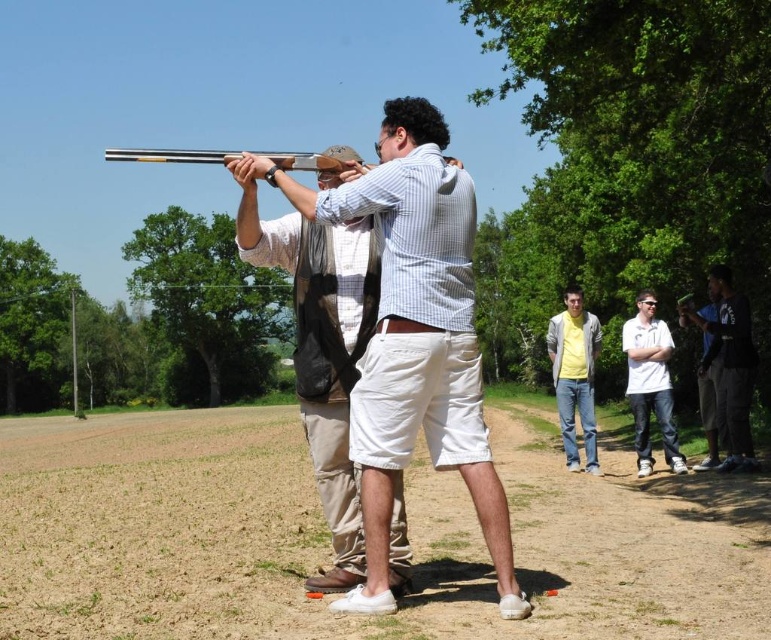
Question: Does matte black shotgun at center appear on the left side of yellow brushed cotton shirt at center?

Choices:
 (A) no
 (B) yes

Answer: (B)

Question: Does matte black shotgun at center appear over yellow brushed cotton shirt at center?

Choices:
 (A) no
 (B) yes

Answer: (B)

Question: Which object is the closest to the white matte shirt at center?

Choices:
 (A) matte black shotgun at center
 (B) yellow brushed cotton shirt at center

Answer: (B)

Question: Which object is farther from the camera taking this photo?

Choices:
 (A) brown dirt field at lower center
 (B) yellow brushed cotton shirt at center
 (C) dark blue jeans at right
 (D) white matte shirt at center

Answer: (D)

Question: Is dark blue jeans at right wider than matte brown shotgun at center?

Choices:
 (A) no
 (B) yes

Answer: (A)

Question: Which object is positioned farthest from the dark blue jeans at right?

Choices:
 (A) brown dirt field at lower center
 (B) white matte shirt at center
 (C) matte black shotgun at center

Answer: (C)